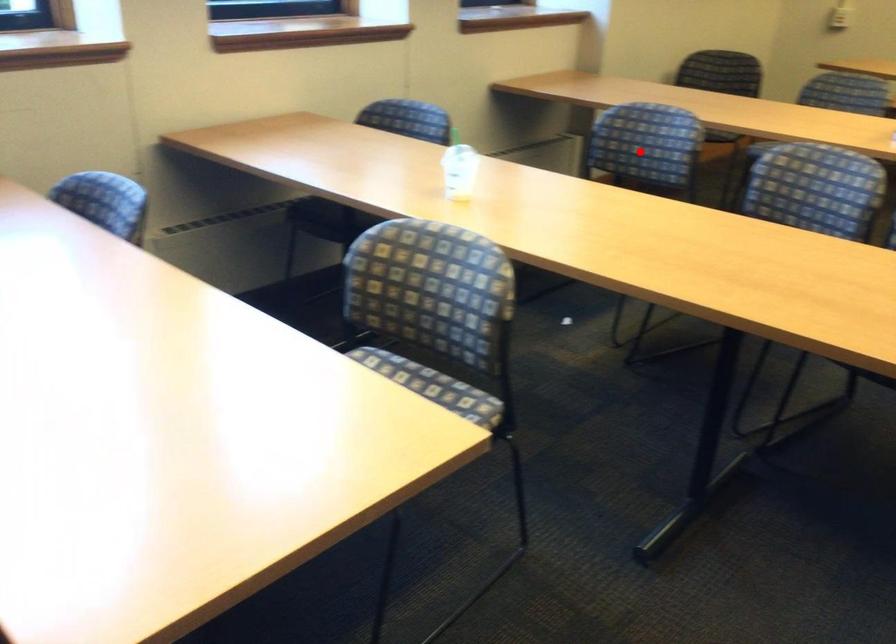
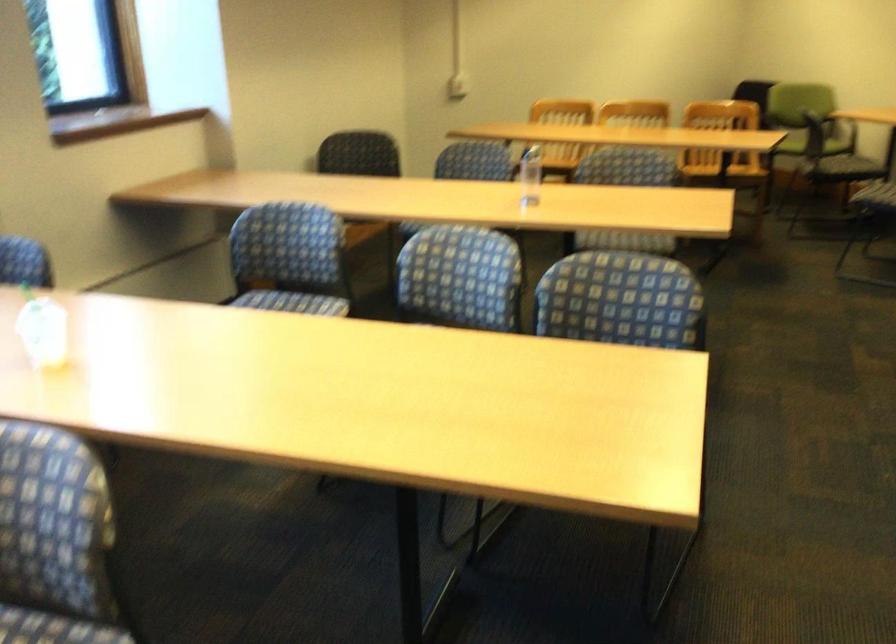
The point at the highlighted location is marked in the first image. Where is the corresponding point in the second image?

(289, 259)